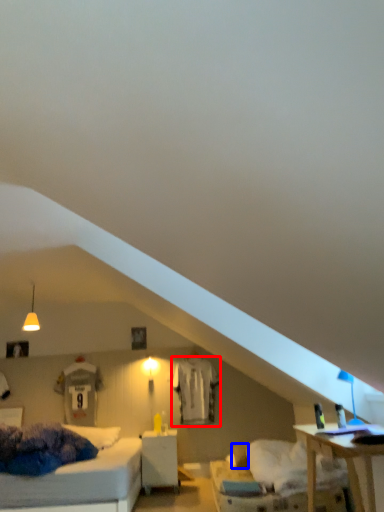
Question: Which point is further to the camera, sheet (highlighted by a red box) or pillow (highlighted by a blue box)?

Choices:
 (A) sheet
 (B) pillow

Answer: (A)